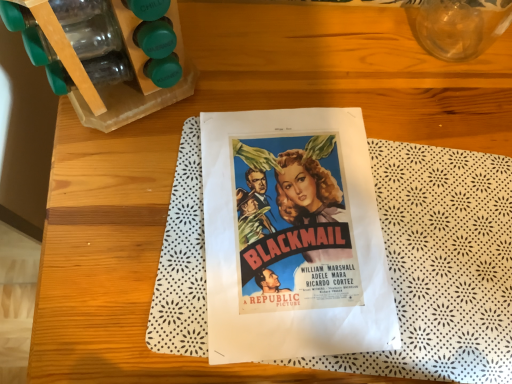
This screenshot has height=384, width=512. Find the location of `empty space that is ontop of vivid paper poster at center`. empty space that is ontop of vivid paper poster at center is located at coordinates (295, 233).